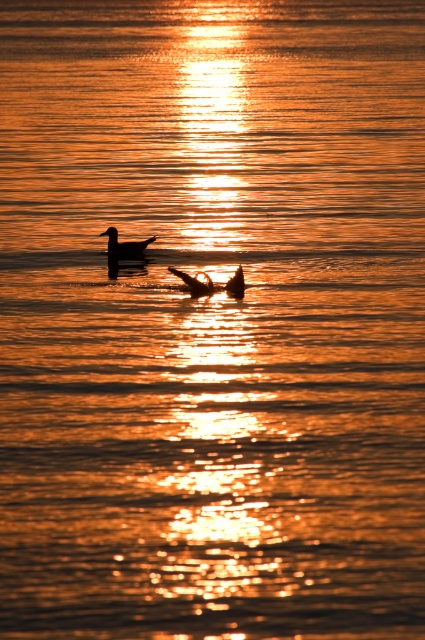
Question: Is silhouette glossy duck at upper center below silhouette feathered duck at center?

Choices:
 (A) no
 (B) yes

Answer: (A)

Question: Which point appears closest to the camera in this image?

Choices:
 (A) (209, 292)
 (B) (127, 252)

Answer: (A)

Question: Can you confirm if silhouette glossy duck at upper center is positioned to the left of silhouette feathered duck at center?

Choices:
 (A) yes
 (B) no

Answer: (A)

Question: Is silhouette glossy duck at upper center thinner than silhouette feathered duck at center?

Choices:
 (A) no
 (B) yes

Answer: (A)